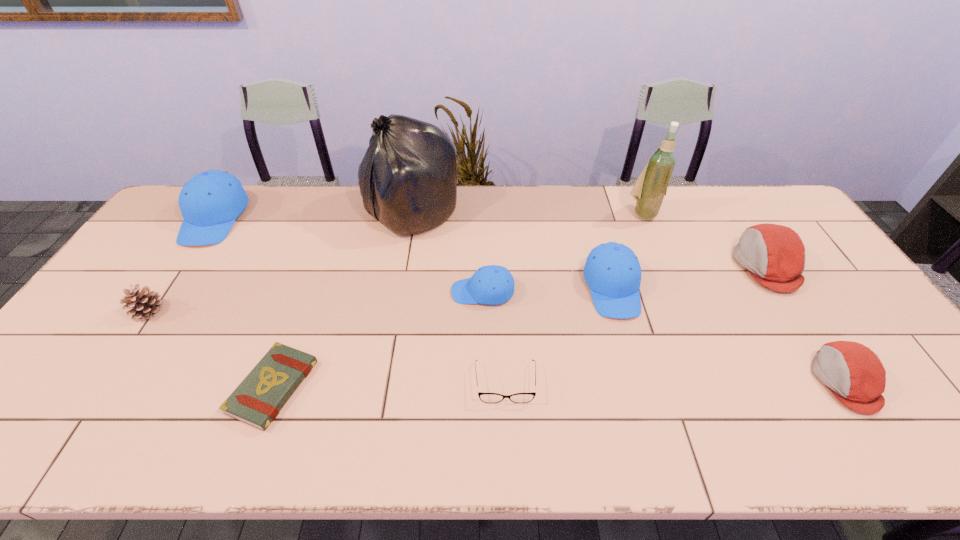
Identify the location of vacant space that's between the shortest object and the fourth object from right to left. The height and width of the screenshot is (540, 960). (443, 338).

You are a GUI agent. You are given a task and a screenshot of the screen. Output one action in this format:
    pyautogui.click(x=<x>, y=<y>)
    Task: Click on the vacant point located between the smaller red cap and the biggest blue cap
    The image size is (960, 540).
    Given the screenshot: What is the action you would take?
    pyautogui.click(x=530, y=300)

The height and width of the screenshot is (540, 960). In order to click on vacant area that lies between the fourth cap from right to left and the seventh object from left to right in this screenshot , I will do `click(547, 290)`.

Where is `vacant space in between the bigger red cap and the second shortest object`? This screenshot has height=540, width=960. vacant space in between the bigger red cap and the second shortest object is located at coordinates (636, 325).

Select which object is the eighth closest to the wine bottle. Please provide its 2D coordinates. Your answer should be formatted as a tuple, i.e. [(x, y)], where the tuple contains the x and y coordinates of a point satisfying the conditions above.

[(210, 201)]

Where is `object that stands as the fourth closest to the nearer red cap`? This screenshot has height=540, width=960. object that stands as the fourth closest to the nearer red cap is located at coordinates (484, 397).

Locate which cap is the third closest to the third cap from left to right. Please provide its 2D coordinates. Your answer should be formatted as a tuple, i.e. [(x, y)], where the tuple contains the x and y coordinates of a point satisfying the conditions above.

[(855, 375)]

In order to click on cap that is the fourth closest to the farthest blue cap in this screenshot , I will do `click(855, 375)`.

Select which blue cap is the third closest to the brown pinecone. Please provide its 2D coordinates. Your answer should be formatted as a tuple, i.e. [(x, y)], where the tuple contains the x and y coordinates of a point satisfying the conditions above.

[(612, 271)]

Where is `the closest blue cap relative to the farthest blue cap`? The width and height of the screenshot is (960, 540). the closest blue cap relative to the farthest blue cap is located at coordinates (490, 285).